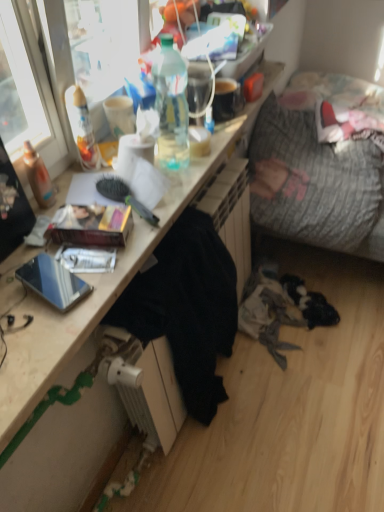
Question: Is wooden desk at center completely or partially outside of black fabric at lower center?

Choices:
 (A) yes
 (B) no

Answer: (A)

Question: Can you confirm if wooden desk at center is taller than black fabric at lower center?

Choices:
 (A) yes
 (B) no

Answer: (B)

Question: From the image's perspective, is wooden desk at center below black fabric at lower center?

Choices:
 (A) no
 (B) yes

Answer: (A)

Question: From the image's perspective, would you say wooden desk at center is positioned over black fabric at lower center?

Choices:
 (A) no
 (B) yes

Answer: (B)

Question: Is black fabric at lower center surrounded by wooden desk at center?

Choices:
 (A) no
 (B) yes

Answer: (A)

Question: Considering their positions, is shiny metallic phone at lower left located in front of or behind wooden desk at center?

Choices:
 (A) front
 (B) behind

Answer: (B)

Question: Is shiny metallic phone at lower left to the left or to the right of wooden desk at center in the image?

Choices:
 (A) left
 (B) right

Answer: (A)

Question: Is shiny metallic phone at lower left wider or thinner than wooden desk at center?

Choices:
 (A) wide
 (B) thin

Answer: (B)

Question: Choose the correct answer: Is shiny metallic phone at lower left inside wooden desk at center or outside it?

Choices:
 (A) inside
 (B) outside

Answer: (B)

Question: From the image's perspective, relative to wooden desk at center, is translucent plastic bottle at upper center, acting as the 1th bottle starting from the right, above or below?

Choices:
 (A) above
 (B) below

Answer: (A)

Question: Would you say translucent plastic bottle at upper center, marked as the second bottle in a left-to-right arrangement, is to the left or to the right of wooden desk at center in the picture?

Choices:
 (A) right
 (B) left

Answer: (A)

Question: Choose the correct answer: Is translucent plastic bottle at upper center, marked as the second bottle in a left-to-right arrangement, inside wooden desk at center or outside it?

Choices:
 (A) inside
 (B) outside

Answer: (B)

Question: From their relative heights in the image, would you say translucent plastic bottle at upper center, marked as the second bottle in a left-to-right arrangement, is taller or shorter than wooden desk at center?

Choices:
 (A) tall
 (B) short

Answer: (A)

Question: Is translucent plastic bottle at upper left, the first bottle when ordered from left to right, wider or thinner than wooden desk at center?

Choices:
 (A) thin
 (B) wide

Answer: (A)

Question: Would you say translucent plastic bottle at upper left, the first bottle when ordered from left to right, is to the left or to the right of wooden desk at center in the picture?

Choices:
 (A) left
 (B) right

Answer: (A)